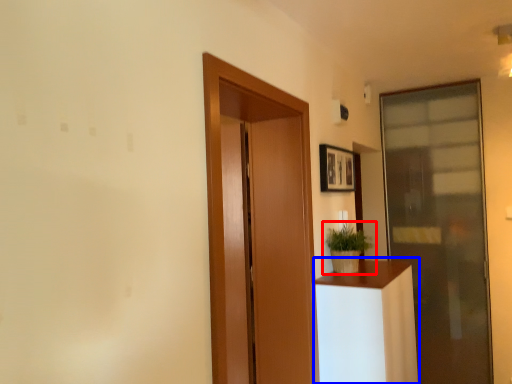
Question: Among these objects, which one is farthest to the camera, houseplant (highlighted by a red box) or furniture (highlighted by a blue box)?

Choices:
 (A) houseplant
 (B) furniture

Answer: (A)